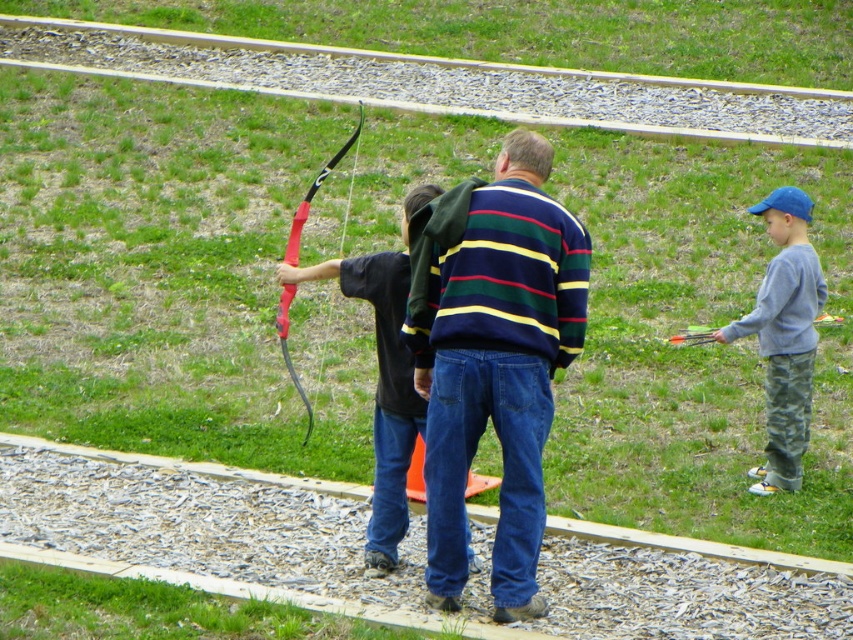
Question: Is striped sweater at center thinner than gray cotton sweatshirt at right?

Choices:
 (A) no
 (B) yes

Answer: (A)

Question: Is striped sweater at center thinner than gray cotton sweatshirt at right?

Choices:
 (A) no
 (B) yes

Answer: (A)

Question: Which point is farther to the camera?

Choices:
 (A) rubberized red bow at center
 (B) striped sweater at center
 (C) gray cotton sweatshirt at right

Answer: (C)

Question: Considering the real-world distances, which object is farthest from the gray cotton sweatshirt at right?

Choices:
 (A) striped sweater at center
 (B) rubberized red bow at center

Answer: (B)

Question: Does gray cotton sweatshirt at right have a lesser width compared to rubberized red bow at center?

Choices:
 (A) no
 (B) yes

Answer: (B)

Question: Which of the following is the closest to the observer?

Choices:
 (A) (810, 364)
 (B) (532, 310)
 (C) (354, 134)

Answer: (B)